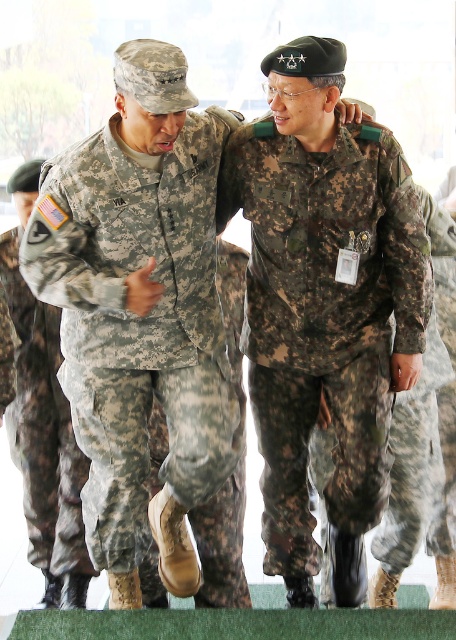
Between camouflage fabric pants at left and camouflage fabric pants at center, which one is positioned lower?

camouflage fabric pants at center is below.

Locate an element on the screen. The height and width of the screenshot is (640, 456). camouflage fabric pants at left is located at coordinates (43, 428).

Where is `camouflage fabric uniform at center`? Image resolution: width=456 pixels, height=640 pixels. camouflage fabric uniform at center is located at coordinates (324, 316).

Between camouflage fabric uniform at center and camouflage fabric pants at center, which one has less height?

camouflage fabric pants at center

Locate an element on the screen. This screenshot has height=640, width=456. camouflage fabric uniform at center is located at coordinates (324, 316).

Consider the image. Is camouflage uniform at center positioned in front of camouflage fabric pants at center?

Yes.

Consider the image. Who is more distant from viewer, (134, 541) or (445, 355)?

Positioned behind is point (445, 355).

Who is more forward, (171, 531) or (408, 525)?

Positioned in front is point (171, 531).

Where is `camouflage uniform at center`? The image size is (456, 640). camouflage uniform at center is located at coordinates (139, 310).